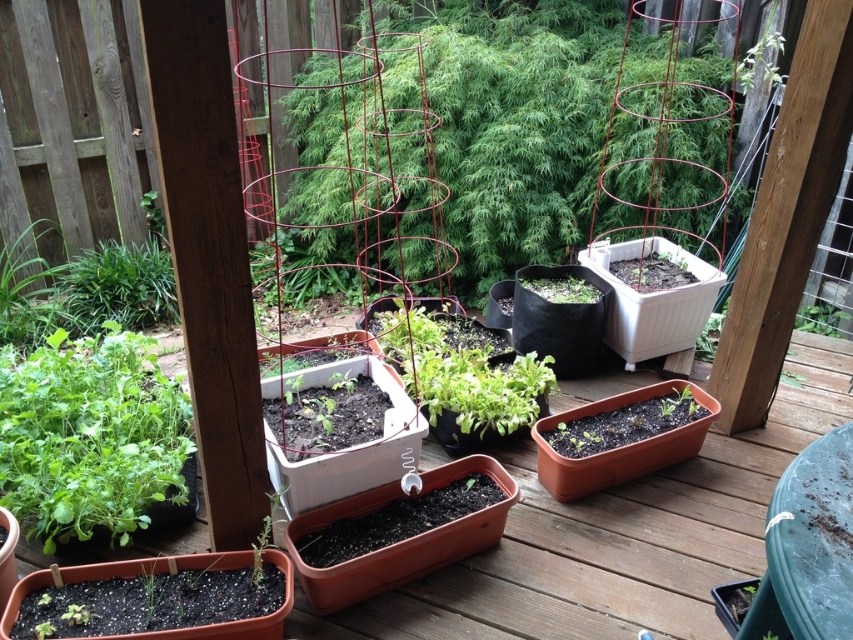
Is point (90, 524) closer to camera compared to point (805, 307)?

Yes.

Who is positioned more to the left, green leafy plant at lower left or green leafy plant at lower right?

green leafy plant at lower left is more to the left.

Is point (100, 528) in front of point (811, 314)?

Yes, point (100, 528) is in front of point (811, 314).

I want to click on green leafy plant at lower left, so click(x=90, y=436).

Between point (549, 292) and point (254, 579), which one is positioned behind?

The point (549, 292) is behind.

Does green matte plant at center appear over green matte plant at lower left?

Result: Indeed, green matte plant at center is positioned over green matte plant at lower left.

Is point (561, 280) positioned before point (254, 586)?

No.

In order to click on green matte plant at center in this screenshot , I will do `click(561, 289)`.

Measure the distance between green leafy plant at lower right and green matte plant at lower left.

The distance of green leafy plant at lower right from green matte plant at lower left is 2.59 meters.

Is green leafy plant at lower right below green matte plant at lower left?

No, green leafy plant at lower right is not below green matte plant at lower left.

This screenshot has width=853, height=640. I want to click on green leafy plant at lower right, so click(x=822, y=320).

At what (x,y) coordinates should I click in order to perform the action: click on green leafy plant at lower right. Please return your answer as a coordinate pair (x, y). The height and width of the screenshot is (640, 853). Looking at the image, I should click on (822, 320).